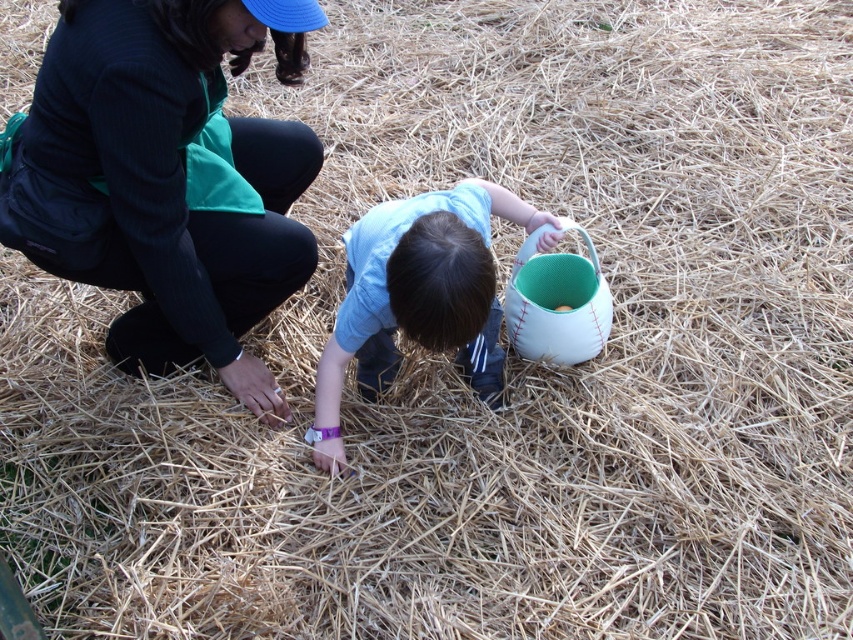
Measure the distance from green fabric jacket at upper left to light blue fabric shirt at center.

green fabric jacket at upper left and light blue fabric shirt at center are 18.41 inches apart.

Can you confirm if green fabric jacket at upper left is taller than light blue fabric shirt at center?

Yes.

Where is `green fabric jacket at upper left`? Image resolution: width=853 pixels, height=640 pixels. green fabric jacket at upper left is located at coordinates (167, 179).